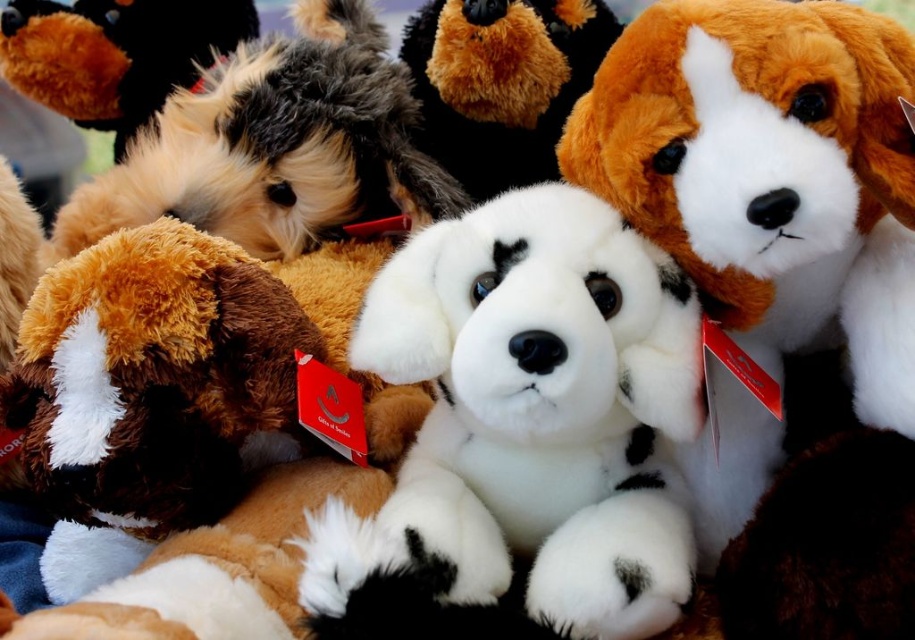
Between white soft plush dog at center and white plush dog at center, which one appears on the right side from the viewer's perspective?

Positioned to the right is white plush dog at center.

Can you confirm if white soft plush dog at center is bigger than white plush dog at center?

Correct, white soft plush dog at center is larger in size than white plush dog at center.

The height and width of the screenshot is (640, 915). What are the coordinates of `white soft plush dog at center` in the screenshot? It's located at (524, 429).

Does point (194, 522) come behind point (533, 116)?

No, it is not.

Which is behind, point (275, 499) or point (555, 60)?

Positioned behind is point (555, 60).

At what (x,y) coordinates should I click in order to perform the action: click on brown plush dog at left. Please return your answer as a coordinate pair (x, y). The width and height of the screenshot is (915, 640). Looking at the image, I should click on (192, 422).

Is point (309, 106) closer to camera compared to point (566, 102)?

Yes, it is in front of point (566, 102).

Is fluffy brown dog at center wider than fluffy brown dog at upper center?

Yes.

At what (x,y) coordinates should I click in order to perform the action: click on fluffy brown dog at center. Please return your answer as a coordinate pair (x, y). Looking at the image, I should click on (276, 145).

Locate an element on the screen. Image resolution: width=915 pixels, height=640 pixels. fluffy brown dog at center is located at coordinates (276, 145).